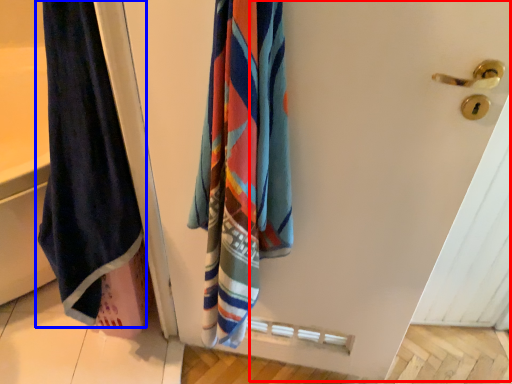
Question: Which of the following is the closest to the observer, screen door (highlighted by a red box) or towel (highlighted by a blue box)?

Choices:
 (A) screen door
 (B) towel

Answer: (A)